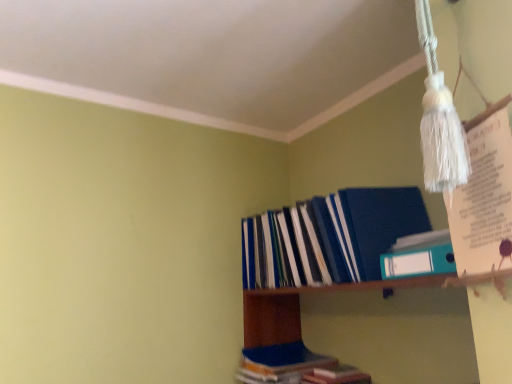
Question: From a real-world perspective, is blue plastic folder at upper right physically located above or below teal plastic ring binder at upper right, the 1th book from the top?

Choices:
 (A) above
 (B) below

Answer: (B)

Question: From the image's perspective, relative to teal plastic ring binder at upper right, the third book ordered from the bottom, is blue plastic folder at upper right above or below?

Choices:
 (A) below
 (B) above

Answer: (A)

Question: Which object is positioned closest to the blue hardcover book at lower center, positioned as the first book in bottom-to-top order?

Choices:
 (A) blue matte folder at upper right, which ranks as the 2th book in top-to-bottom order
 (B) teal plastic ring binder at upper right, the third book ordered from the bottom
 (C) blue plastic folder at upper right

Answer: (C)

Question: Considering the real-world distances, which object is closest to the blue hardcover book at lower center, the 3th book from the top?

Choices:
 (A) teal plastic ring binder at upper right, the 1th book from the top
 (B) blue plastic folder at upper right
 (C) blue matte folder at upper right, which ranks as the 2th book in top-to-bottom order

Answer: (B)